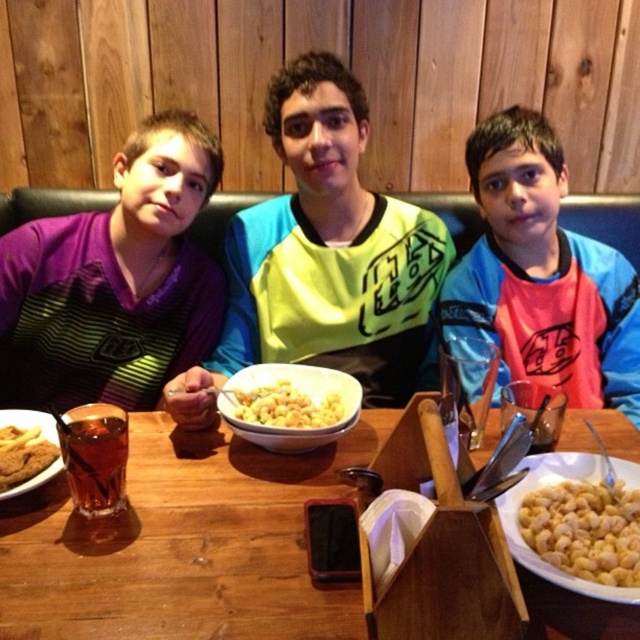
Is brown glass at lower left taller than yellow matte pasta at center?

Correct, brown glass at lower left is much taller as yellow matte pasta at center.

This screenshot has width=640, height=640. What do you see at coordinates (96, 456) in the screenshot? I see `brown glass at lower left` at bounding box center [96, 456].

The height and width of the screenshot is (640, 640). Find the location of `brown glass at lower left`. brown glass at lower left is located at coordinates (96, 456).

Who is positioned more to the left, purple jersey at left or golden brown cookie at lower left?

purple jersey at left is more to the left.

Is purple jersey at left behind golden brown cookie at lower left?

Yes, purple jersey at left is further from the viewer.

Which is in front, point (22, 312) or point (49, 460)?

Point (49, 460)

Where is `purple jersey at left`? The width and height of the screenshot is (640, 640). purple jersey at left is located at coordinates (115, 282).

Is yellow matte pasta at center behind golden brown cookie at lower left?

Yes, it is behind golden brown cookie at lower left.

Which is more to the right, yellow matte pasta at center or golden brown cookie at lower left?

yellow matte pasta at center is more to the right.

Between point (257, 417) and point (40, 465), which one is positioned in front?

Positioned in front is point (40, 465).

The width and height of the screenshot is (640, 640). Find the location of `yellow matte pasta at center`. yellow matte pasta at center is located at coordinates (285, 406).